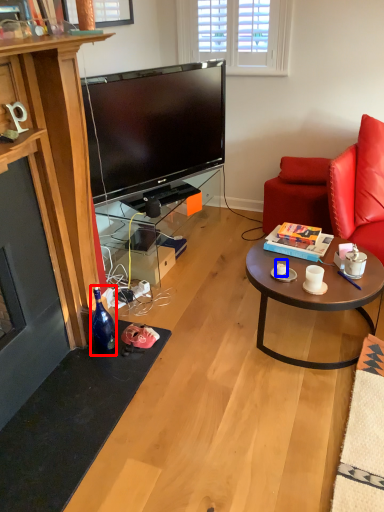
Question: Which point is further to the camera, bottle (highlighted by a red box) or coffee cup (highlighted by a blue box)?

Choices:
 (A) bottle
 (B) coffee cup

Answer: (B)